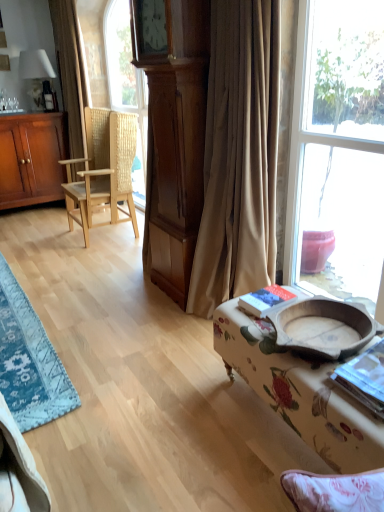
Where is `vacant space to the left of beige fabric curtain at center, placed as the second curtain when sorted from back to front`? vacant space to the left of beige fabric curtain at center, placed as the second curtain when sorted from back to front is located at coordinates (159, 326).